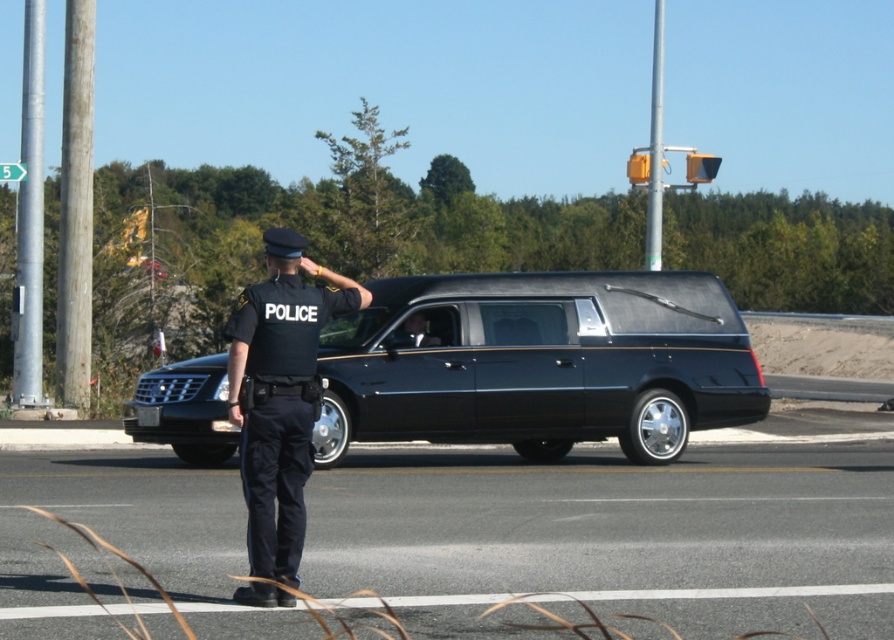
Based on the coordinates provided in the scene description, where is the black glossy hearse at center located in terms of its 2D position?

The black glossy hearse at center is located at the 2D coordinates point (538, 362).

You are standing in the scene and want to move from the point at coordinates point (x=551, y=332) to the point at coordinates point (x=245, y=432). Which direction should you face to walk towards the second point?

You should face downward and to the right because point (x=245, y=432) is located below and to the right of point (x=551, y=332).

You are a pedestrian standing at the edge of the road and see the black glossy hearse at center and the black uniform at center. Which object is closer to you?

The black glossy hearse at center is closer to you because it is further to the viewer than the black uniform at center.